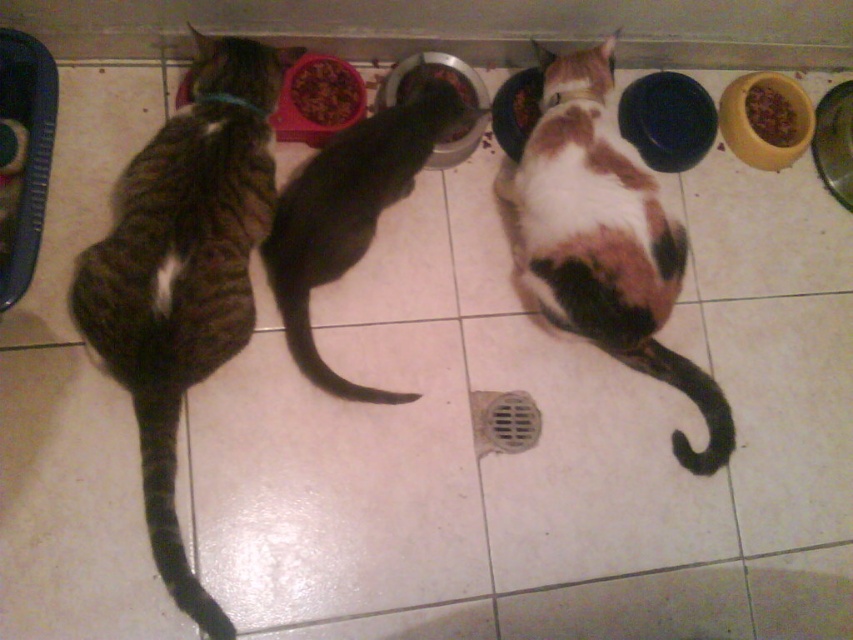
Question: Which object is positioned closest to the brown matte food at upper right?

Choices:
 (A) calico fur cat at center
 (B) black glossy cat at center
 (C) brown matte bowl at center
 (D) striped fur cat at left

Answer: (A)

Question: Considering the relative positions of black glossy cat at center and brown matte bowl at center in the image provided, where is black glossy cat at center located with respect to brown matte bowl at center?

Choices:
 (A) left
 (B) right

Answer: (A)

Question: Does striped fur cat at left appear on the right side of brown textured food at center?

Choices:
 (A) no
 (B) yes

Answer: (A)

Question: Can you confirm if brown matte bowl at center is positioned to the left of brown matte food at center?

Choices:
 (A) yes
 (B) no

Answer: (A)

Question: Considering the real-world distances, which object is closest to the brown matte food at upper right?

Choices:
 (A) calico fur cat at center
 (B) brown matte bowl at center
 (C) striped fur cat at left

Answer: (A)

Question: Among these objects, which one is farthest from the camera?

Choices:
 (A) brown matte bowl at center
 (B) striped fur cat at left
 (C) calico fur cat at center
 (D) brown matte food at center

Answer: (D)